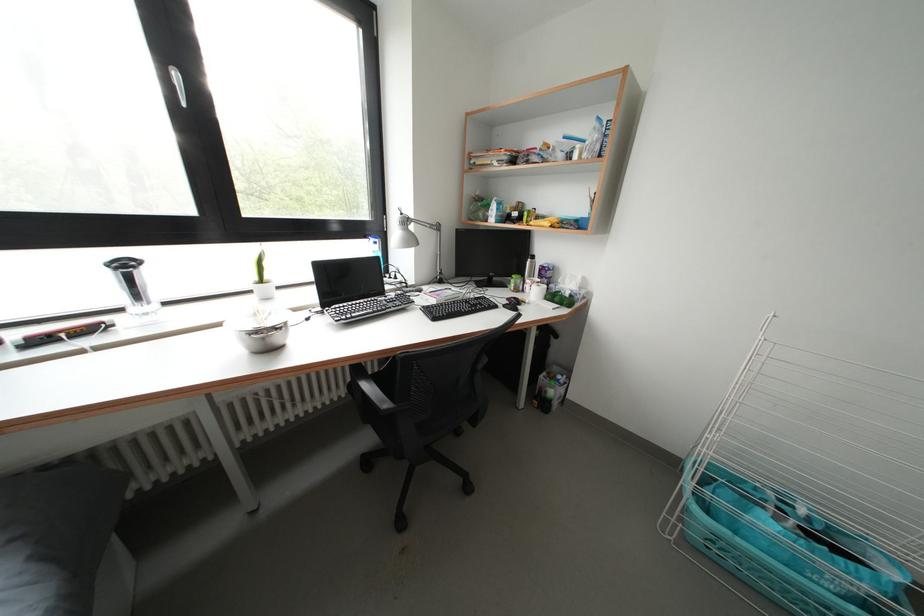
This screenshot has height=616, width=924. Describe the element at coordinates (377, 249) in the screenshot. I see `a blue spray bottle` at that location.